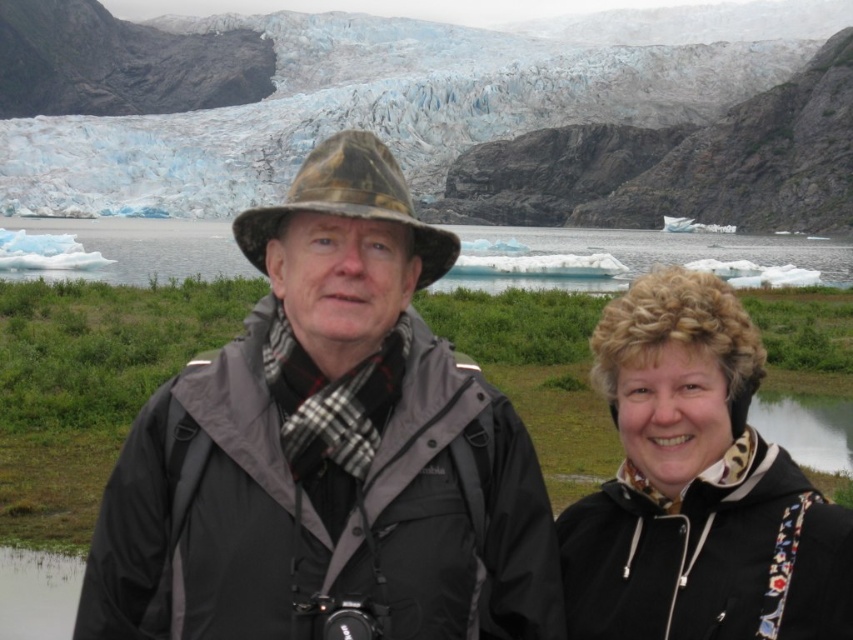
Consider the image. You are a photographer standing at the point closest to the camera. You want to take a photo of the glacier in the background. Which point should you stand at to ensure the glacier is in focus? Please choose between point (790, 150) and point (239, 499).

You should stand at point (790, 150) because it is further to the camera than point (239, 499), which would place you closer to the glacier for better focus.